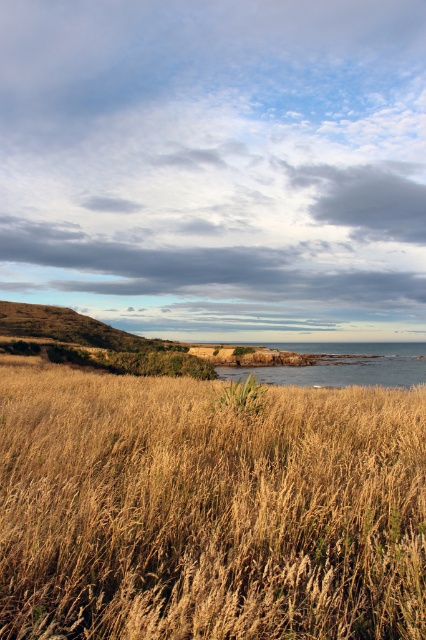
Question: Where is dry grass at center located in relation to green grassy weed at center in the image?

Choices:
 (A) above
 (B) below

Answer: (B)

Question: Which object is closer to the camera taking this photo?

Choices:
 (A) green grassy weed at center
 (B) blue water at center
 (C) dry grass at center

Answer: (C)

Question: Which point appears farthest from the camera in this image?

Choices:
 (A) (356, 358)
 (B) (252, 378)

Answer: (A)

Question: Is dry grass at center to the right of blue water at center from the viewer's perspective?

Choices:
 (A) yes
 (B) no

Answer: (B)

Question: Does dry grass at center have a greater width compared to blue water at center?

Choices:
 (A) yes
 (B) no

Answer: (B)

Question: Estimate the real-world distances between objects in this image. Which object is farther from the blue water at center?

Choices:
 (A) dry grass at center
 (B) green grassy weed at center

Answer: (B)